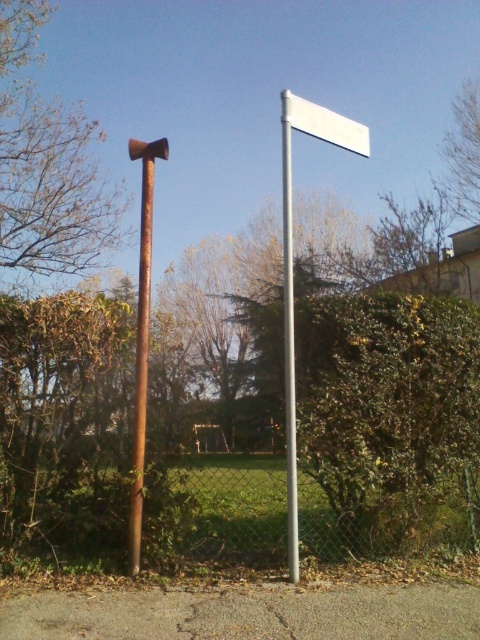
You are a delivery person who needs to attach a new sign to the silver metallic signpost at center. However, you notice there is already a white plastic sign at upper center. Can you place the new sign below the existing one without overlapping?

The silver metallic signpost at center is taller than the white plastic sign at upper center, so there is enough vertical space below the white plastic sign at upper center to attach the new sign without overlapping.

You are a painter who needs to paint both the rusty metal pole at left and the silver metallic signpost at center. Since you can only carry enough paint for one object at a time, you decide to start with the one closer to you. Which object should you paint first?

The rusty metal pole at left is positioned on the left side of the silver metallic signpost at center, so it is closer to you. You should start by painting the rusty metal pole at left first.

You are standing in the outdoor scene and want to touch both the silver metallic signpost at center and the white plastic sign at upper center. Which one can you reach first without moving your feet?

The silver metallic signpost at center is closer to the viewer than the white plastic sign at upper center, so you can reach it first without moving your feet.